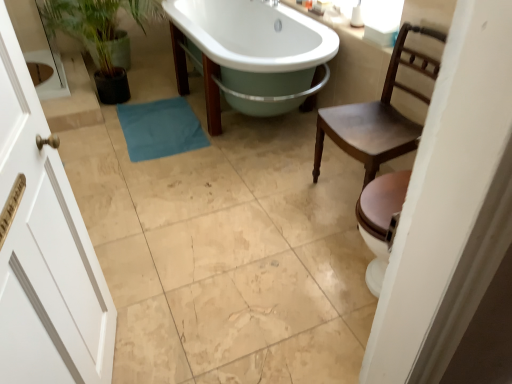
Question: Can you confirm if white glossy bathtub at center is bigger than green matte plant at left?

Choices:
 (A) no
 (B) yes

Answer: (B)

Question: Considering the relative positions of white glossy bathtub at center and green matte plant at left in the image provided, is white glossy bathtub at center behind green matte plant at left?

Choices:
 (A) yes
 (B) no

Answer: (B)

Question: Considering the relative sizes of white glossy bathtub at center and green matte plant at left in the image provided, is white glossy bathtub at center taller than green matte plant at left?

Choices:
 (A) no
 (B) yes

Answer: (A)

Question: Is white glossy bathtub at center turned away from green matte plant at left?

Choices:
 (A) no
 (B) yes

Answer: (A)

Question: Is white glossy bathtub at center in front of green matte plant at left?

Choices:
 (A) no
 (B) yes

Answer: (B)

Question: In the image, is green matte plant at left positioned in front of or behind blue fabric bath towel at center?

Choices:
 (A) front
 (B) behind

Answer: (A)

Question: Is green matte plant at left wider or thinner than blue fabric bath towel at center?

Choices:
 (A) thin
 (B) wide

Answer: (B)

Question: In terms of height, does green matte plant at left look taller or shorter compared to blue fabric bath towel at center?

Choices:
 (A) short
 (B) tall

Answer: (B)

Question: Is green matte plant at left inside the boundaries of blue fabric bath towel at center, or outside?

Choices:
 (A) outside
 (B) inside

Answer: (A)

Question: Looking at their shapes, would you say brown wooden chair at right is wider or thinner than white glossy bathtub at center?

Choices:
 (A) wide
 (B) thin

Answer: (B)

Question: Is brown wooden chair at right in front of or behind white glossy bathtub at center in the image?

Choices:
 (A) behind
 (B) front

Answer: (B)

Question: From their relative heights in the image, would you say brown wooden chair at right is taller or shorter than white glossy bathtub at center?

Choices:
 (A) short
 (B) tall

Answer: (B)

Question: From a real-world perspective, relative to white glossy bathtub at center, is brown wooden chair at right vertically above or below?

Choices:
 (A) below
 (B) above

Answer: (B)

Question: Is white glossy bathtub at center spatially inside green matte plant at left, or outside of it?

Choices:
 (A) outside
 (B) inside

Answer: (A)

Question: From the image's perspective, relative to green matte plant at left, is white glossy bathtub at center above or below?

Choices:
 (A) above
 (B) below

Answer: (B)